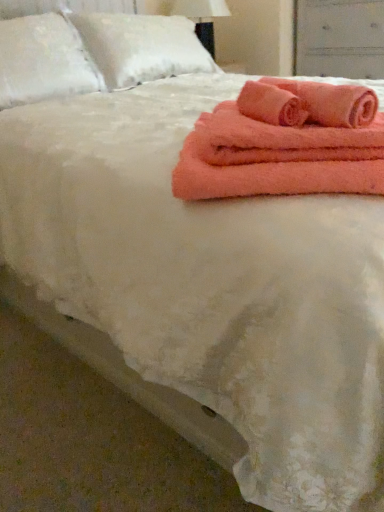
Question: In terms of height, does matte white drawer at upper right look taller or shorter compared to white fluffy pillow at upper left, placed as the 2th pillow when sorted from right to left?

Choices:
 (A) tall
 (B) short

Answer: (A)

Question: From a real-world perspective, is matte white drawer at upper right above or below white fluffy pillow at upper left, placed as the 2th pillow when sorted from right to left?

Choices:
 (A) below
 (B) above

Answer: (A)

Question: Estimate the real-world distances between objects in this image. Which object is closer to the coral fleece towels at upper right?

Choices:
 (A) white fabric lampshade at upper center
 (B) matte white drawer at upper right
 (C) coral plush bath towel at upper right
 (D) white fluffy pillow at upper left, placed as the second pillow when sorted from left to right
 (E) white fluffy pillow at upper left, placed as the 2th pillow when sorted from right to left

Answer: (C)

Question: Which is farther from the matte white drawer at upper right?

Choices:
 (A) white fluffy pillow at upper left, placed as the 2th pillow when sorted from right to left
 (B) white fabric lampshade at upper center
 (C) white fluffy pillow at upper left, which is the 1th pillow in right-to-left order
 (D) coral fleece towels at upper right
 (E) coral plush bath towel at upper right

Answer: (D)